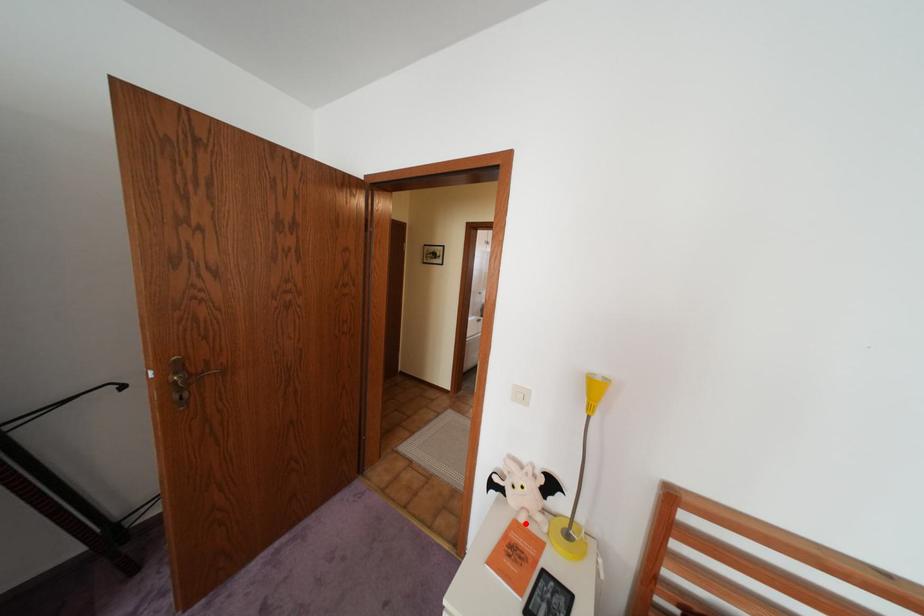
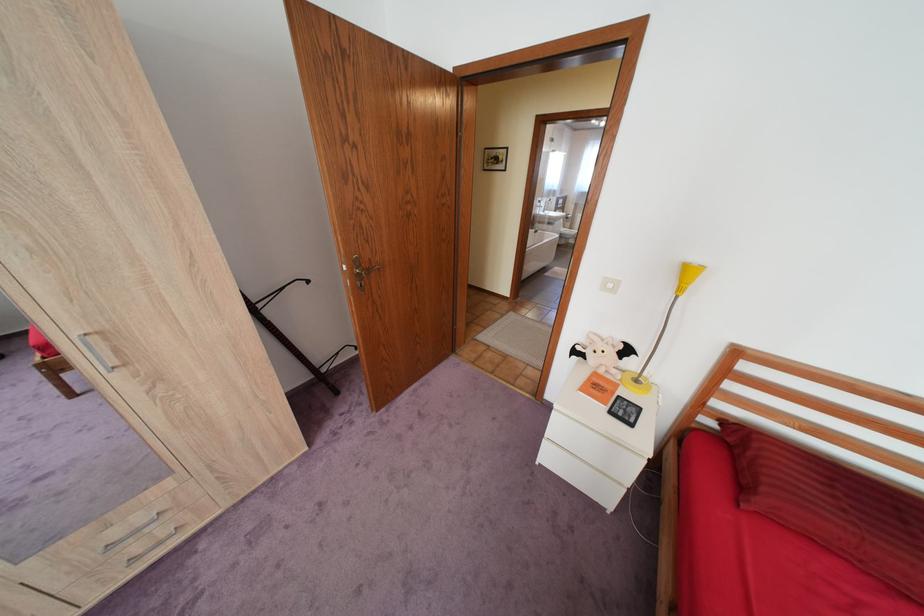
Question: I am providing you with two images of the same scene from different viewpoints. Given a red point in image1, look at the same physical point in image2. Is it:

Choices:
 (A) Closer to the viewpoint
 (B) Farther from the viewpoint

Answer: (A)